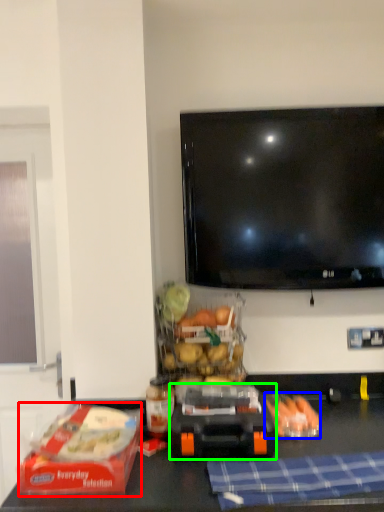
Question: Based on their relative distances, which object is farther from lunch box (highlighted by a red box)? Choose from food (highlighted by a blue box) and appliance (highlighted by a green box).

Choices:
 (A) food
 (B) appliance

Answer: (A)